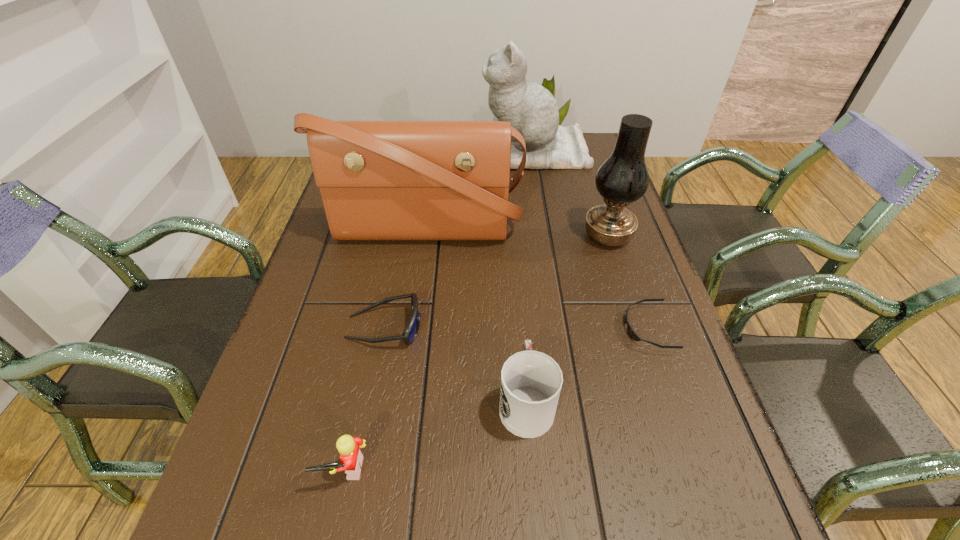
I want to click on free region located 0.130m on the front-facing side of the cat, so click(x=442, y=151).

Identify the location of free spot located 0.110m on the front-facing side of the cat. (448, 151).

This screenshot has height=540, width=960. What are the coordinates of `free space located 0.320m on the front-facing side of the cat` in the screenshot? It's located at (384, 151).

At what (x,y) coordinates should I click in order to perform the action: click on free region located 0.140m on the front flap of the satchel. Please return your answer as a coordinate pair (x, y). Looking at the image, I should click on coord(416,298).

Where is `free space located 0.200m on the back of the oil lamp`? free space located 0.200m on the back of the oil lamp is located at coordinates (589, 179).

The width and height of the screenshot is (960, 540). What are the coordinates of `vacant space situated on the handle side of the second nearest object` in the screenshot? It's located at (513, 243).

The height and width of the screenshot is (540, 960). I want to click on vacant position located 0.150m on the handle side of the second nearest object, so click(518, 309).

Locate an element on the screen. This screenshot has width=960, height=540. vacant space situated 0.210m on the handle side of the second nearest object is located at coordinates (516, 289).

At what (x,y) coordinates should I click in order to perform the action: click on free region located 0.300m on the front-facing side of the taller sunglasses. Please return your answer as a coordinate pair (x, y). Looking at the image, I should click on pos(564,327).

Find the location of a particular element. The width and height of the screenshot is (960, 540). free space located 0.160m on the front-facing side of the right sunglasses is located at coordinates (549, 328).